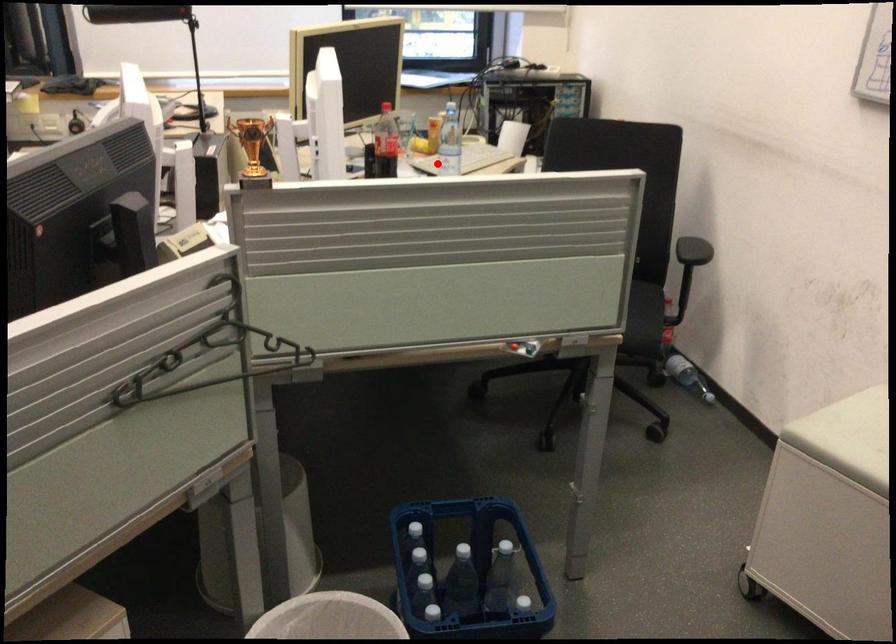
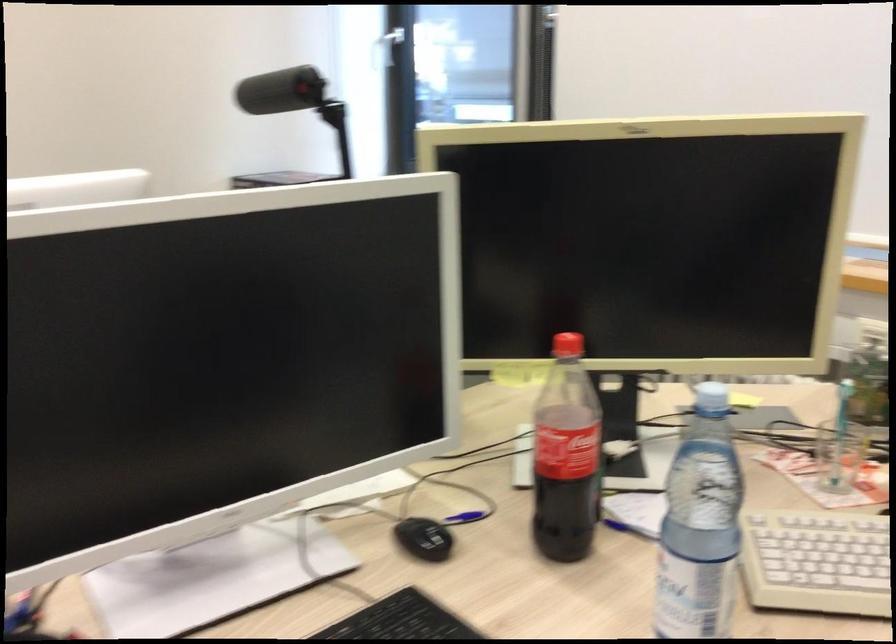
Find the pixel in the second image that matches the highlighted location in the first image.

(815, 562)